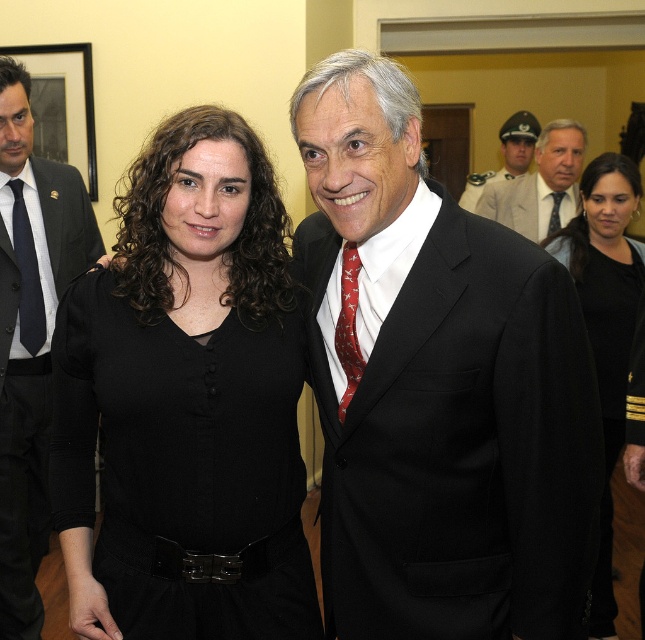
How much distance is there between uniformed officer at center and matte black tie at center?

1.83 meters

Which is more to the right, uniformed officer at center or matte black tie at center?

Positioned to the right is uniformed officer at center.

Is point (521, 152) positioned in front of point (553, 230)?

No, it is not.

Find the location of a particular element. uniformed officer at center is located at coordinates (504, 156).

Can you confirm if black fabric dress at center is smaller than uniformed officer at center?

Yes, black fabric dress at center is smaller than uniformed officer at center.

Does point (633, 193) come behind point (506, 132)?

No, it is in front of (506, 132).

Is point (588, 220) in front of point (526, 141)?

Yes.

At what (x,y) coordinates should I click in order to perform the action: click on black fabric dress at center. Please return your answer as a coordinate pair (x, y). The image size is (645, 640). Looking at the image, I should click on (606, 324).

Is black suit at center below red silk tie at center?

Indeed, black suit at center is positioned under red silk tie at center.

Does point (580, 320) come in front of point (342, 250)?

Yes, it is.

Is point (510, 272) positioned behind point (339, 358)?

No, (510, 272) is in front of (339, 358).

Identify the location of black suit at center. This screenshot has height=640, width=645. (439, 388).